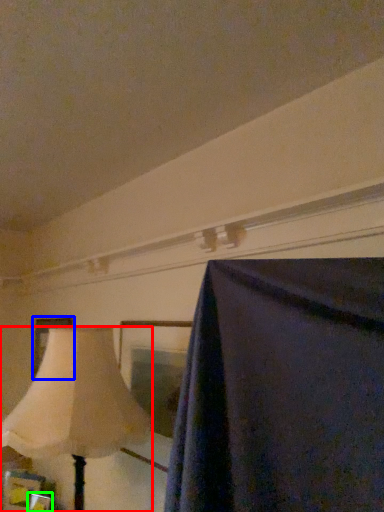
Question: Which is nearer to the lamp (highlighted by a red box)? picture frame (highlighted by a blue box) or picture frame (highlighted by a green box).

Choices:
 (A) picture frame
 (B) picture frame

Answer: (A)